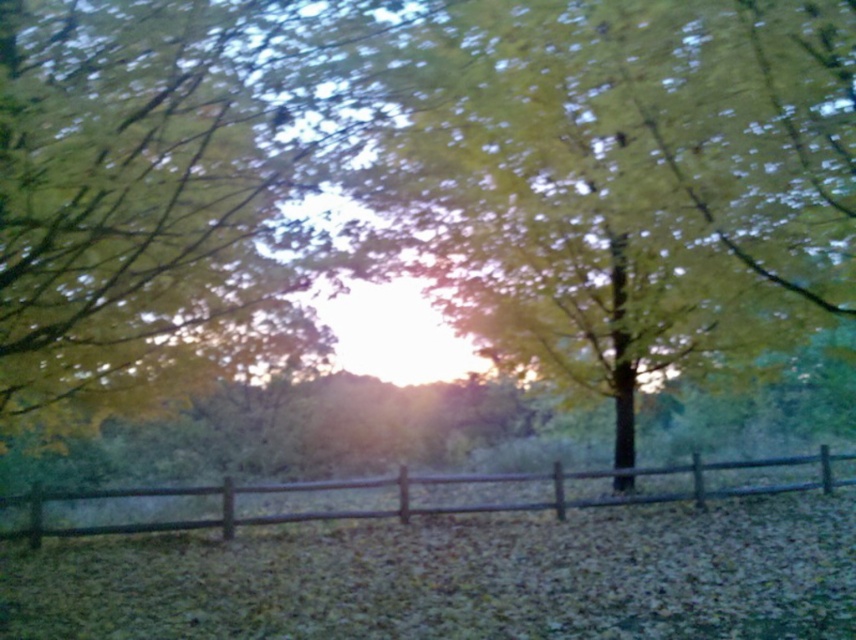
You are standing in the serene outdoor scene and want to place a small decorative rock between the two points, point (565,266) and point (756,488). Which point is closer to you so you can start placing the rock there?

Point (565,266) is closer to you than point (756,488), so you should start placing the rock near point (565,266).

You are standing in the middle of a forest path and see the green matte tree at center and the brown wooden fence at lower center. Which object is taller?

The green matte tree at center is much taller than the brown wooden fence at lower center.